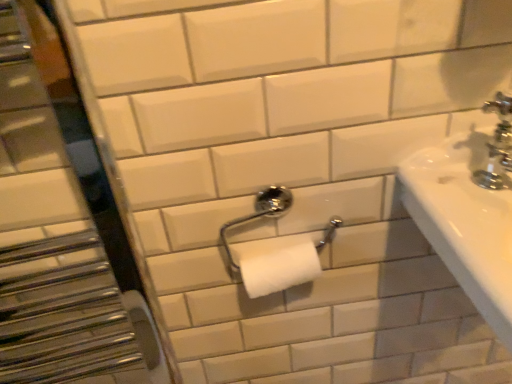
Question: From a real-world perspective, is chrome metallic faucet at upper right physically located above or below chrome metallic toilet paper holder at center?

Choices:
 (A) above
 (B) below

Answer: (A)

Question: Based on their positions, is chrome metallic faucet at upper right located to the left or right of chrome metallic toilet paper holder at center?

Choices:
 (A) left
 (B) right

Answer: (B)

Question: Considering the real-world distances, which object is closest to the brushed metal mirror at left?

Choices:
 (A) chrome metallic toilet paper holder at center
 (B) chrome metallic faucet at upper right

Answer: (A)

Question: Which object is positioned closest to the chrome metallic toilet paper holder at center?

Choices:
 (A) chrome metallic faucet at upper right
 (B) brushed metal mirror at left

Answer: (A)